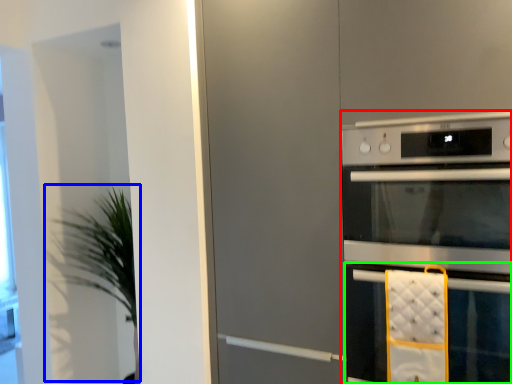
Question: Which is farther away from home appliance (highlighted by a red box)? plant (highlighted by a blue box) or oven (highlighted by a green box)?

Choices:
 (A) plant
 (B) oven

Answer: (A)